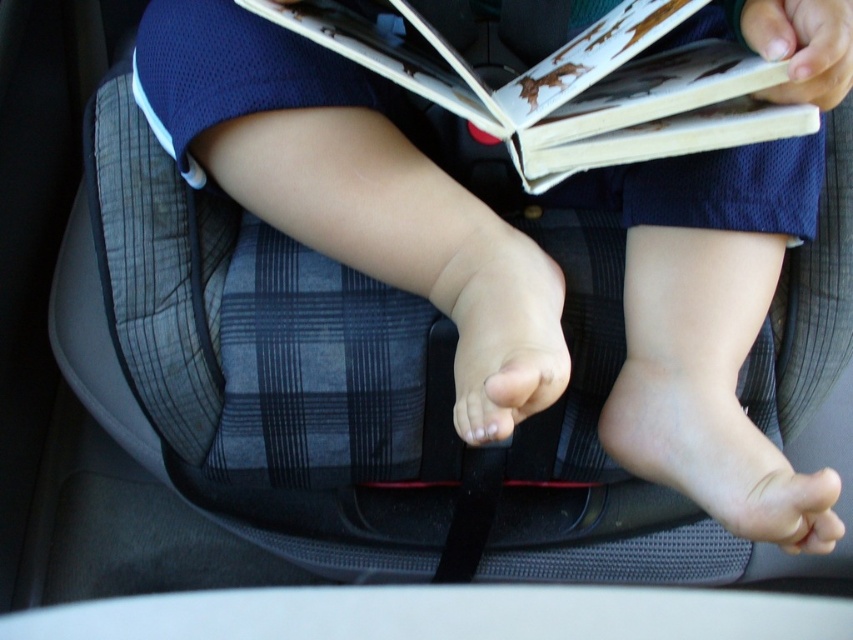
You are a parent trying to secure your child in the car seat. You need to attach the seatbelt to a point that is closer to the child. Which point should you choose between point [610,51] and point [543,355]?

Point [610,51] is in front of point [543,355], so it is closer to the child. Therefore, you should attach the seatbelt to point [610,51] to secure the child properly.